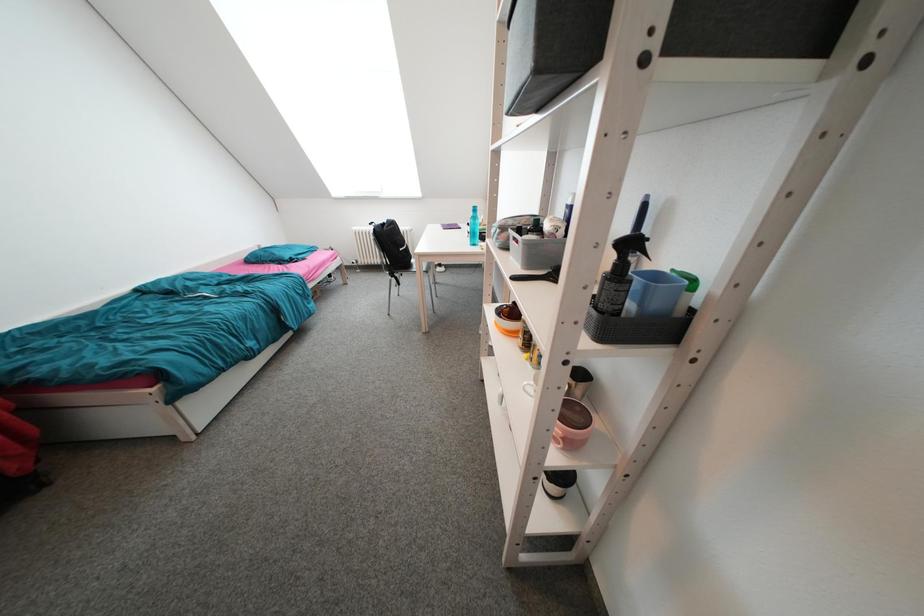
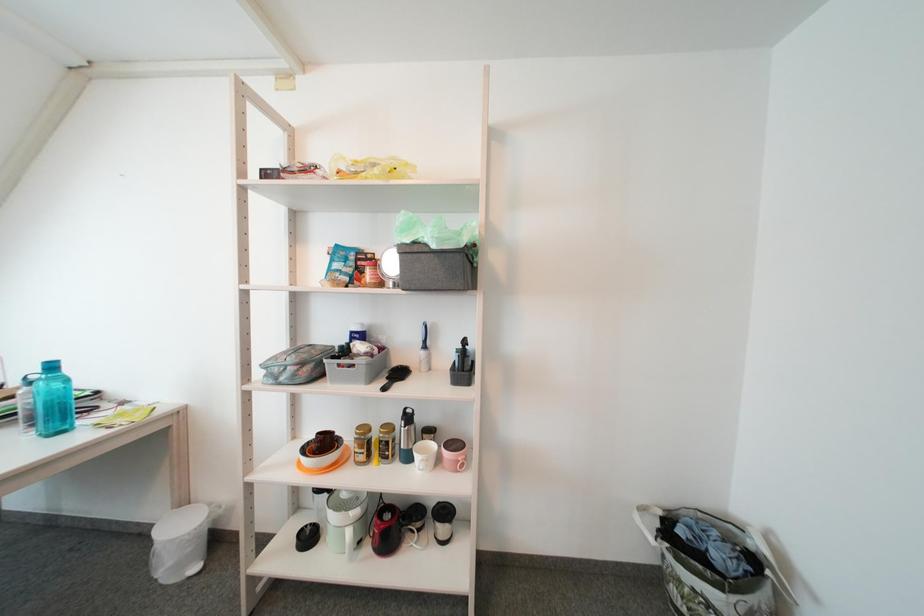
Question: The first image is from the beginning of the video and the second image is from the end. How did the camera likely rotate when shooting the video?

Choices:
 (A) Left
 (B) Right
 (C) Up
 (D) Down

Answer: (B)